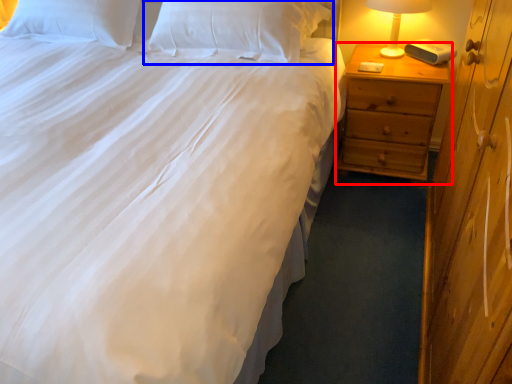
Question: Which point is further to the camera, nightstand (highlighted by a red box) or pillow (highlighted by a blue box)?

Choices:
 (A) nightstand
 (B) pillow

Answer: (A)